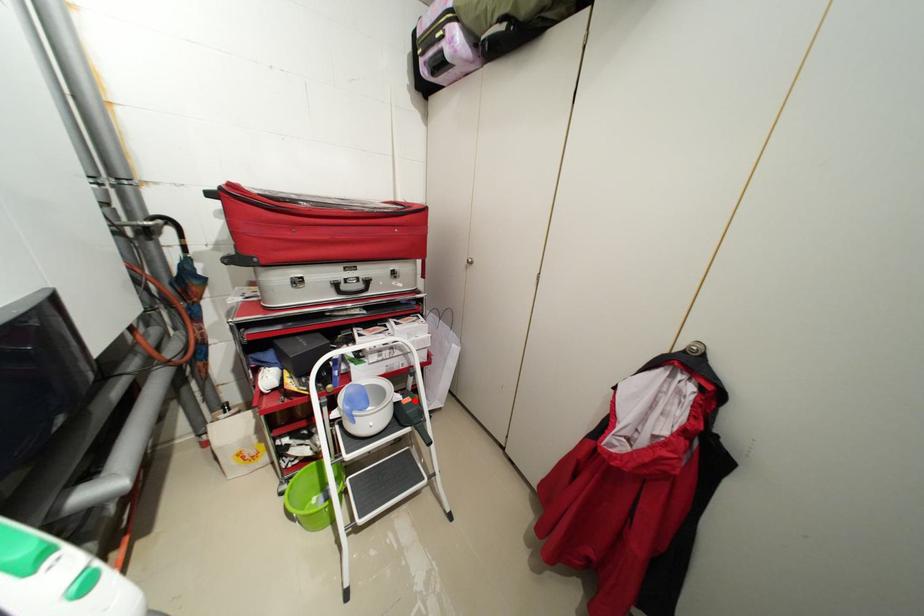
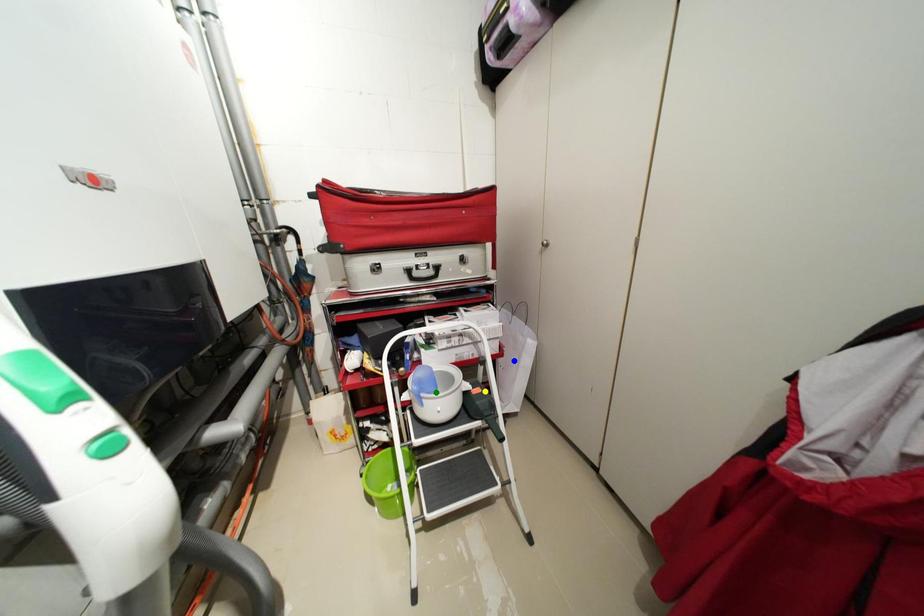
Question: I am providing you with two images of the same scene from different viewpoints. A red point is marked on the first image. You are given multiple points on the second image. Which mark in image 2 goes with the point in image 1?

Choices:
 (A) green point
 (B) yellow point
 (C) blue point

Answer: (B)